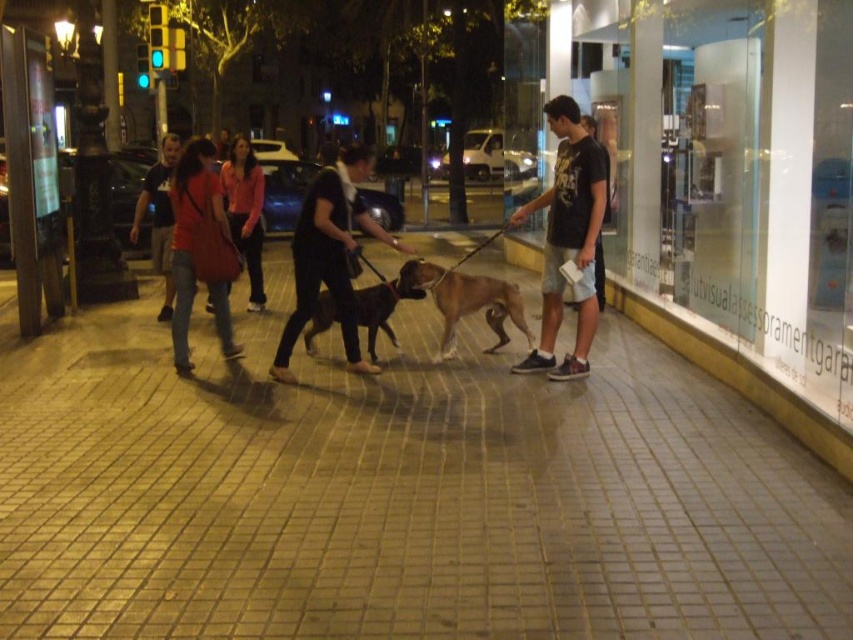
You are standing on the brick pavement at center and want to greet the person wearing the matte red jacket at center. In which direction should you move to reach them?

The brick pavement at center is to the right of the matte red jacket at center, so you should move to your left to reach them.

You are standing at the pedestrian area in the image and want to take a photo of the two points mentioned. Which point, point [131,401] or point [396,292], will appear larger in your camera view?

Point [131,401] will appear larger in the camera view because it is closer to the camera than point [396,292].